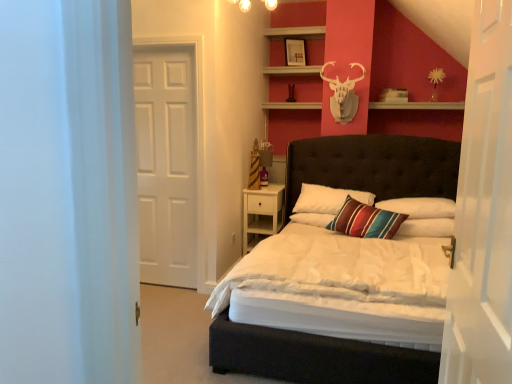
Question: From a real-world perspective, is striped fabric pillow at center, the first pillow from the right, above or below white glossy door at right, the second door positioned from the left?

Choices:
 (A) above
 (B) below

Answer: (B)

Question: In the image, is striped fabric pillow at center, the first pillow from the right, positioned in front of or behind white glossy door at right, the 1th door from the right?

Choices:
 (A) behind
 (B) front

Answer: (A)

Question: Which object is the closest to the white matte door at left, positioned as the 2th door in right-to-left order?

Choices:
 (A) white glossy door at right, the second door positioned from the left
 (B) striped fabric pillow at center, the first pillow from the right
 (C) white wood nightstand at lower right
 (D) striped fabric pillow at center, which appears as the 1th pillow when viewed from the left
 (E) matte white picture frame at upper center

Answer: (C)

Question: Which object is the farthest from the striped fabric pillow at center, the first pillow from the right?

Choices:
 (A) matte black bed at center
 (B) white wood nightstand at lower right
 (C) striped fabric pillow at center, which appears as the 1th pillow when viewed from the left
 (D) wooden shelf at upper center
 (E) white glossy door at right, the first door viewed from the front

Answer: (E)